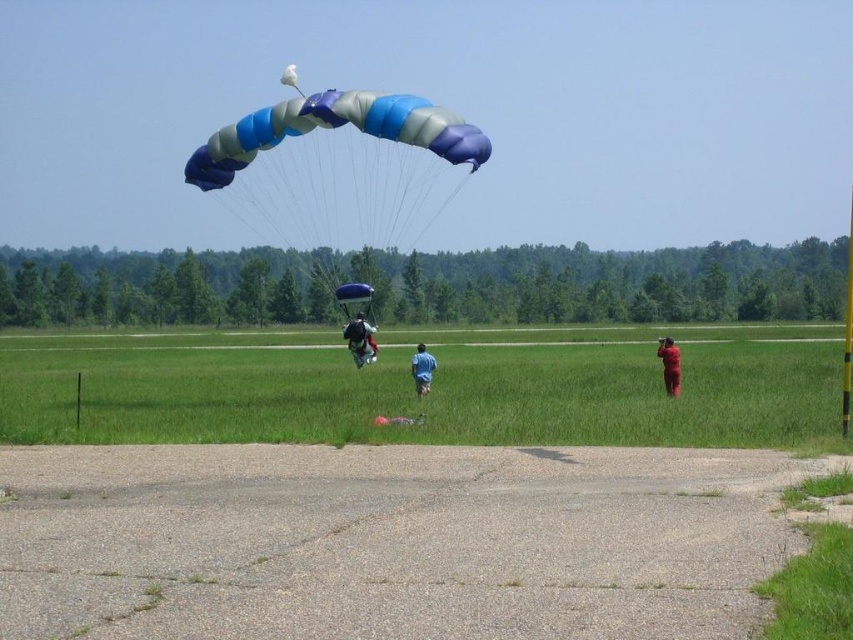
You are a drone operator controlling a drone that needs to land on the green grass at center. According to the coordinates provided, where should you direct the drone to land?

The green grass at center is located at coordinates point (413,390), so you should direct the drone to land there.